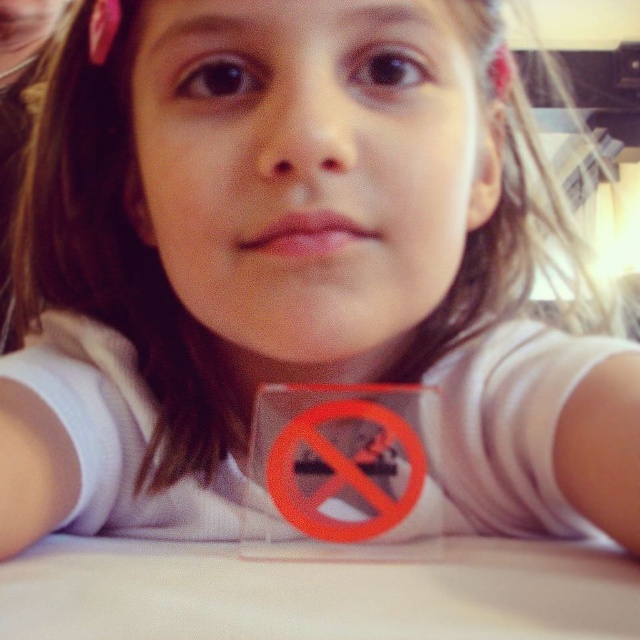
You are setting up a small table and sign for a community event. The scene shows a white matte table at center and an orange plastic sign at center. Based on the image, which object is positioned lower in the frame?

The white matte table at center is located below the orange plastic sign at center, so it is positioned lower in the frame.